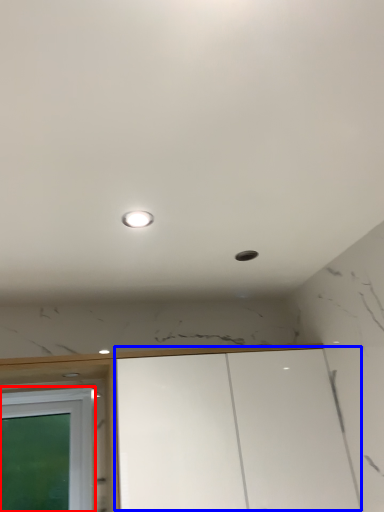
Question: Which object is further to the camera taking this photo, window (highlighted by a red box) or cabinetry (highlighted by a blue box)?

Choices:
 (A) window
 (B) cabinetry

Answer: (A)